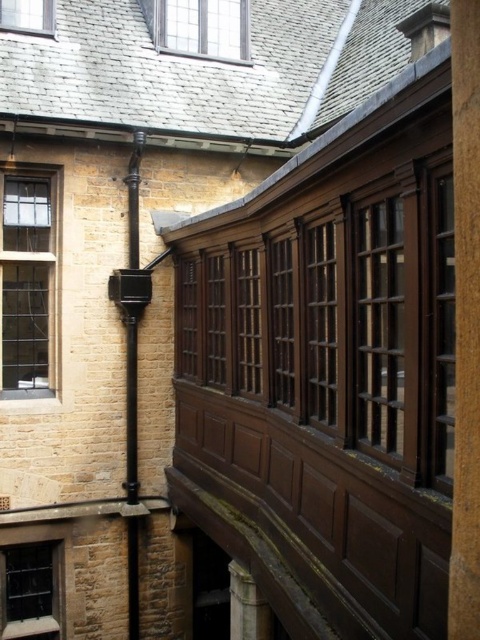
You are standing in the courtyard of the historic building. You notice two points marked on the wall. The first point is at coordinate point (474,513), and the second is at point (4,276). From your perspective, which point is closer to you?

Point (474,513) is in front of point (4,276), so it is closer to you.

You are standing in the courtyard of the historic building and want to look through the windows to see the view outside. Which window, the matte glass window at lower left or the clear glass window at upper left, would allow you to see the outside more clearly?

The clear glass window at upper left allows for clearer visibility since it is behind the matte glass window at lower left, but since the matte glass window at lower left is in front of it, the clear glass window at upper left might be obstructed. However, the clear glass itself offers better clarity than matte glass. The answer depends on whether the clear window is visible past the matte one. If unobstructed, clear is better. But according to the description, the matte is in front, so the clear might be